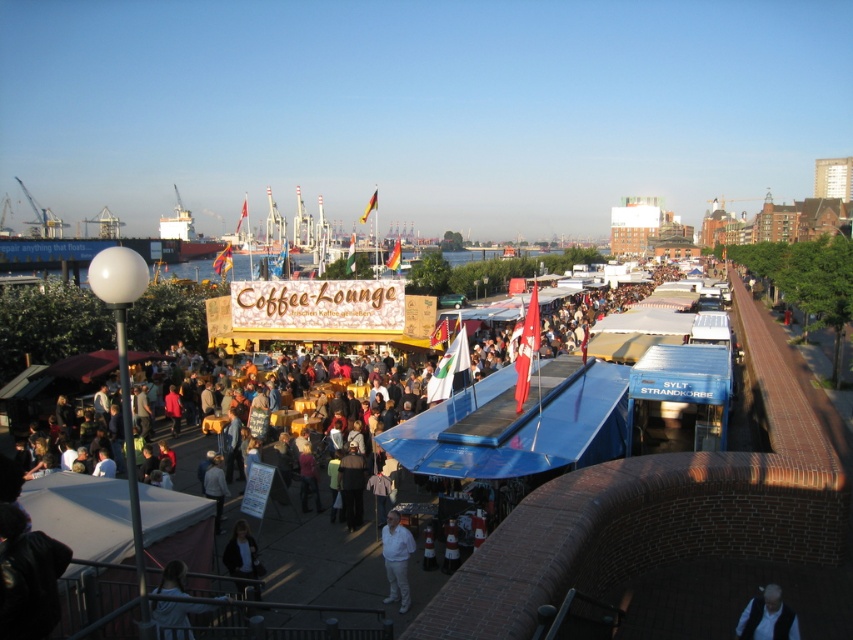
You are a vendor at the market and need to pack two items into a box. You have a white cotton shirt at center and a dark gray sweater at center. Which item should you place first into the box to ensure both fit properly?

The white cotton shirt at center is bigger than the dark gray sweater at center, so you should place the white cotton shirt at center first to make space for the smaller dark gray sweater at center.

You are a fashion designer observing the crowd at the outdoor market. You notice a light brown leather jacket at lower left and a white cotton shirt at center. Which clothing item is wider?

The light brown leather jacket at lower left is wider than the white cotton shirt at center.

You are a salesperson at the Coffee Lounge stall and need to hand out promotional flyers. You have a stack of flyers on the counter. Which jacket, the light brown leather jacket at lower left or the dark blue jacket at lower center, is closer to the flyers?

The dark blue jacket at lower center is closer to the flyers because the light brown leather jacket at lower left is smaller than dark blue jacket at lower center, implying it is positioned further away.